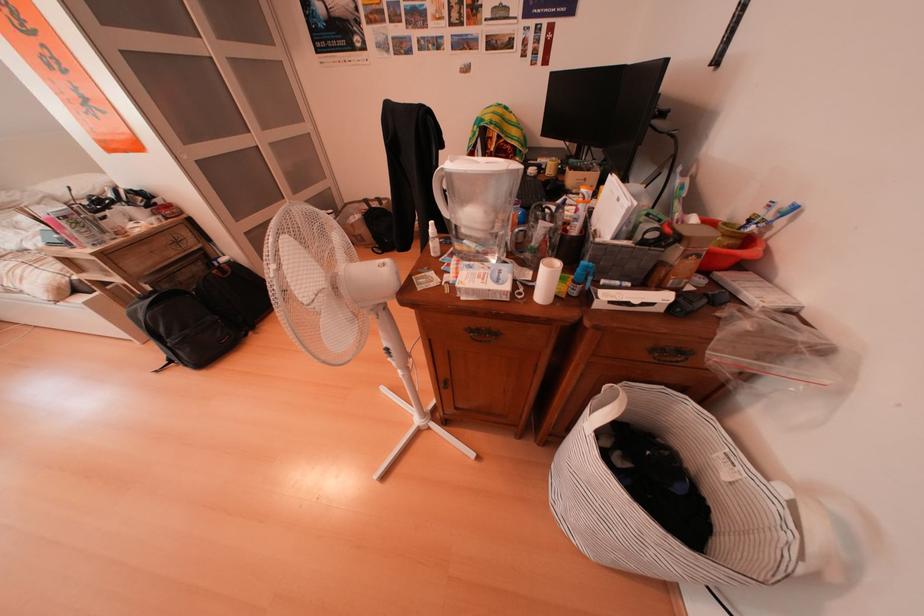
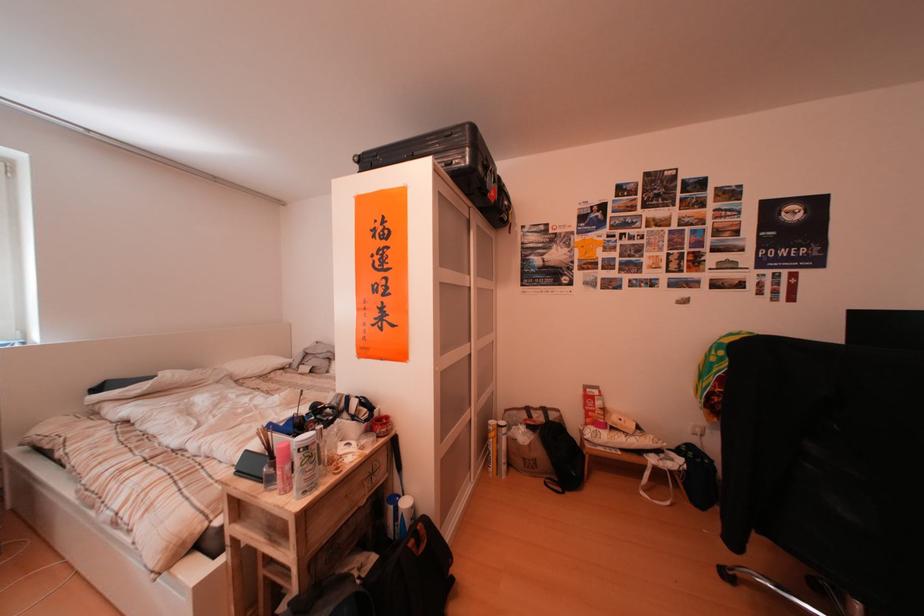
Locate, in the second image, the point that corresponds to (379,207) in the first image.

(541, 415)